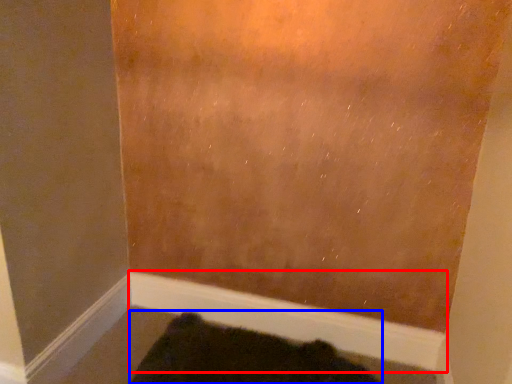
Question: Which object is closer to the camera taking this photo, molding (highlighted by a red box) or animal (highlighted by a blue box)?

Choices:
 (A) molding
 (B) animal

Answer: (B)